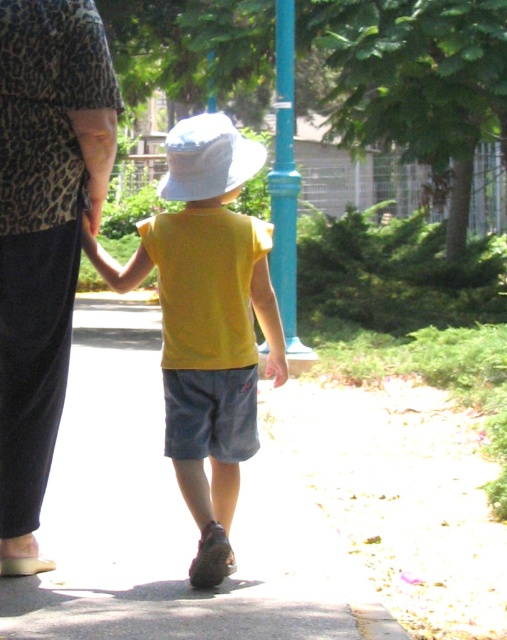
Question: Considering the real-world distances, which object is closest to the gray concrete pavement at center?

Choices:
 (A) white matte hat at center
 (B) yellow matte shirt at center
 (C) leopard print blouse at upper left

Answer: (C)

Question: Is gray concrete pavement at center closer to camera compared to white matte hat at center?

Choices:
 (A) yes
 (B) no

Answer: (A)

Question: Is gray concrete pavement at center below yellow matte shirt at center?

Choices:
 (A) no
 (B) yes

Answer: (B)

Question: Does gray concrete pavement at center appear over yellow matte shirt at center?

Choices:
 (A) yes
 (B) no

Answer: (B)

Question: Considering the real-world distances, which object is farthest from the gray concrete pavement at center?

Choices:
 (A) yellow matte shirt at center
 (B) white matte hat at center
 (C) leopard print blouse at upper left

Answer: (B)

Question: Which point is farther from the camera taking this photo?

Choices:
 (A) (39, 272)
 (B) (29, 579)

Answer: (B)